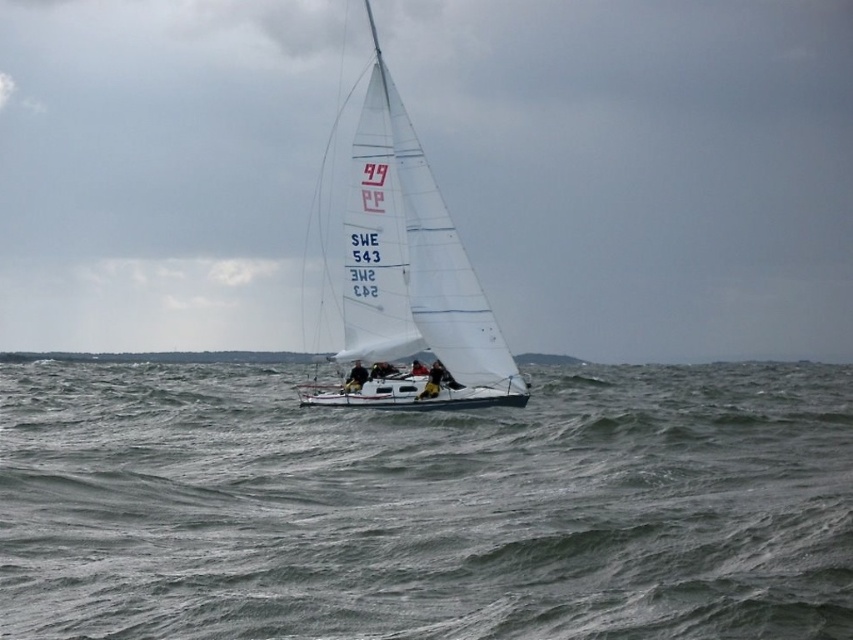
Question: Can you confirm if white sailboat at center is positioned to the right of gray water at center?

Choices:
 (A) yes
 (B) no

Answer: (A)

Question: Considering the real-world distances, which object is farthest from the gray water at center?

Choices:
 (A) white sailboat at center
 (B) white matte sailboat at center

Answer: (A)

Question: Which point is closer to the camera?

Choices:
 (A) white sailboat at center
 (B) white matte sailboat at center
 (C) gray water at center

Answer: (C)

Question: Is white sailboat at center to the right of white matte sailboat at center from the viewer's perspective?

Choices:
 (A) yes
 (B) no

Answer: (A)

Question: Which object is closer to the camera taking this photo?

Choices:
 (A) gray water at center
 (B) white matte sailboat at center
 (C) white sailboat at center

Answer: (A)

Question: Considering the relative positions of white sailboat at center and gray water at center in the image provided, where is white sailboat at center located with respect to gray water at center?

Choices:
 (A) right
 (B) left

Answer: (A)